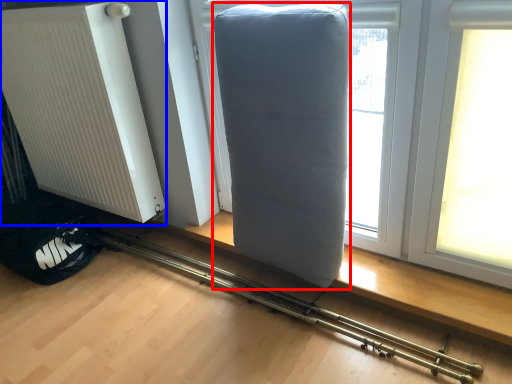
Question: Which point is further to the camera, furniture (highlighted by a red box) or radiator (highlighted by a blue box)?

Choices:
 (A) furniture
 (B) radiator

Answer: (B)